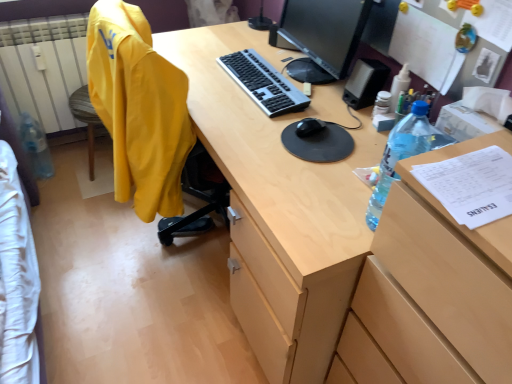
You are a GUI agent. You are given a task and a screenshot of the screen. Output one action in this format:
    pyautogui.click(x=<x>, y=<y>)
    Task: Click on the vacant area situated to the left side of black plastic speaker at upper right
    The height and width of the screenshot is (384, 512).
    Given the screenshot: What is the action you would take?
    pyautogui.click(x=319, y=93)